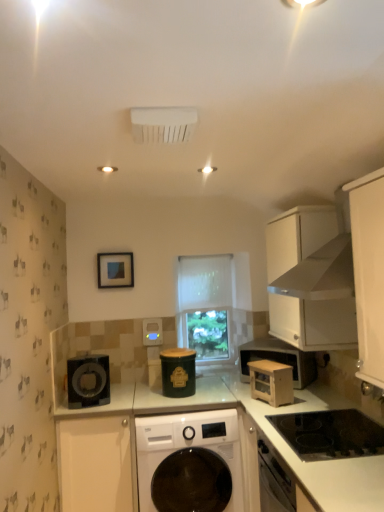
Question: Can you confirm if wooden microwave at center-right is taller than white sheer at center?

Choices:
 (A) yes
 (B) no

Answer: (B)

Question: From a real-world perspective, is wooden microwave at center-right under white sheer at center?

Choices:
 (A) yes
 (B) no

Answer: (A)

Question: Can you confirm if wooden microwave at center-right is wider than white sheer at center?

Choices:
 (A) no
 (B) yes

Answer: (B)

Question: Is wooden microwave at center-right positioned in front of white sheer at center?

Choices:
 (A) yes
 (B) no

Answer: (A)

Question: Is wooden microwave at center-right smaller than white sheer at center?

Choices:
 (A) no
 (B) yes

Answer: (B)

Question: Does wooden microwave at center-right appear on the right side of white sheer at center?

Choices:
 (A) yes
 (B) no

Answer: (A)

Question: Is green matte canister at center, which appears as the second appliance when viewed from the back, completely or partially inside matte blue picture frame at upper center?

Choices:
 (A) no
 (B) yes

Answer: (A)

Question: Can you confirm if matte blue picture frame at upper center is wider than green matte canister at center, which appears as the second appliance when viewed from the back?

Choices:
 (A) yes
 (B) no

Answer: (B)

Question: Can you confirm if matte blue picture frame at upper center is smaller than green matte canister at center, which ranks as the first appliance in right-to-left order?

Choices:
 (A) yes
 (B) no

Answer: (A)

Question: From a real-world perspective, is matte blue picture frame at upper center beneath green matte canister at center, the 2th appliance when ordered from front to back?

Choices:
 (A) no
 (B) yes

Answer: (A)

Question: Is matte blue picture frame at upper center thinner than green matte canister at center, which is counted as the third appliance, starting from the left?

Choices:
 (A) no
 (B) yes

Answer: (B)

Question: Is matte blue picture frame at upper center positioned before green matte canister at center, which is counted as the third appliance, starting from the left?

Choices:
 (A) no
 (B) yes

Answer: (A)

Question: Is white matte cabinet at lower left, which ranks as the 2th cabinetry in right-to-left order, facing towards wooden microwave at center-right?

Choices:
 (A) yes
 (B) no

Answer: (B)